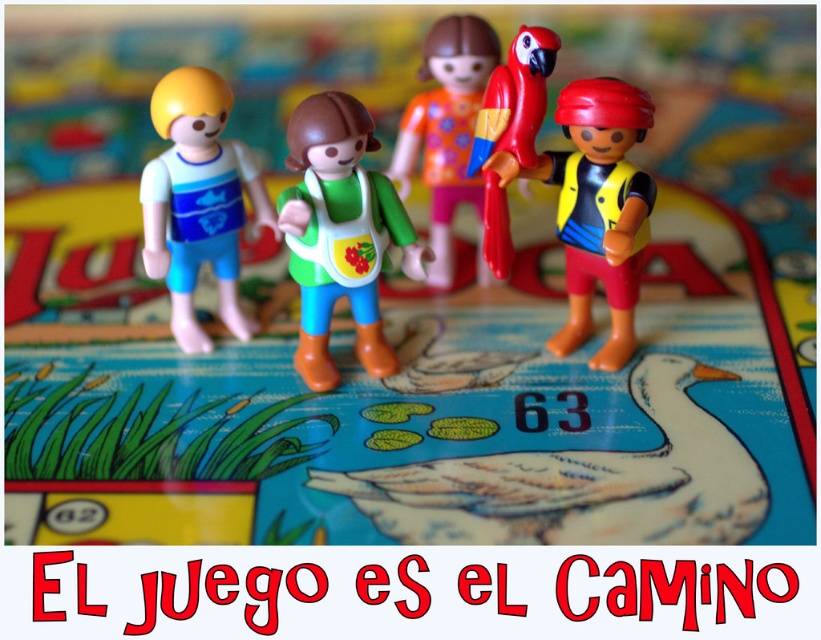
Who is lower down, green matte vest at center or shiny plastic parrot at center?

Positioned lower is green matte vest at center.

Is green matte vest at center to the left of shiny plastic parrot at center from the viewer's perspective?

Yes, green matte vest at center is to the left of shiny plastic parrot at center.

Does point (370, 120) come farther from viewer compared to point (516, 147)?

No, it is not.

Where is `green matte vest at center`? The image size is (821, 640). green matte vest at center is located at coordinates (340, 232).

Does matte plastic doll at center have a greater width compared to shiny plastic parrot at center?

Indeed, matte plastic doll at center has a greater width compared to shiny plastic parrot at center.

Is matte plastic doll at center above shiny plastic parrot at center?

Indeed, matte plastic doll at center is positioned over shiny plastic parrot at center.

You are a GUI agent. You are given a task and a screenshot of the screen. Output one action in this format:
    pyautogui.click(x=<x>, y=<y>)
    Task: Click on the matte plastic doll at center
    
    Given the screenshot: What is the action you would take?
    pyautogui.click(x=447, y=132)

Is point (606, 202) farther from viewer compared to point (438, 182)?

No.

Does yellow matte vest at center appear under matte plastic doll at center?

Indeed, yellow matte vest at center is positioned under matte plastic doll at center.

Is point (569, 106) closer to camera compared to point (395, 176)?

Yes, point (569, 106) is closer to viewer.

Image resolution: width=821 pixels, height=640 pixels. What are the coordinates of `yellow matte vest at center` in the screenshot? It's located at (597, 208).